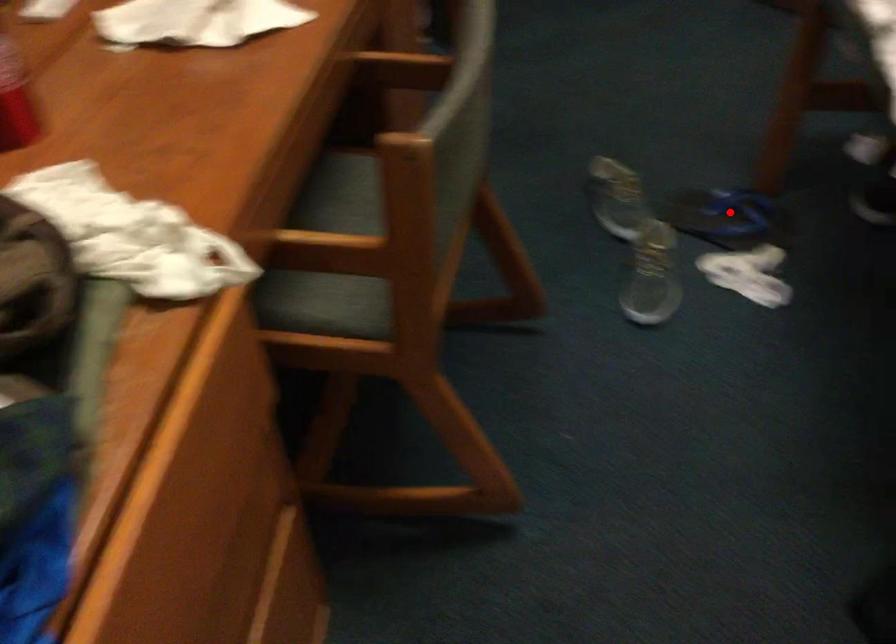
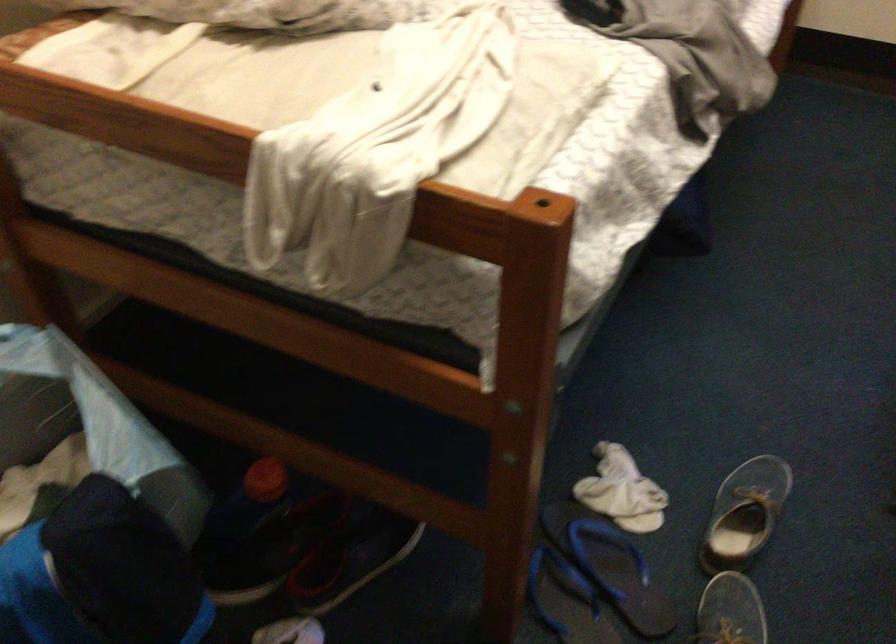
Find the pixel in the second image that matches the highlighted location in the first image.

(566, 600)